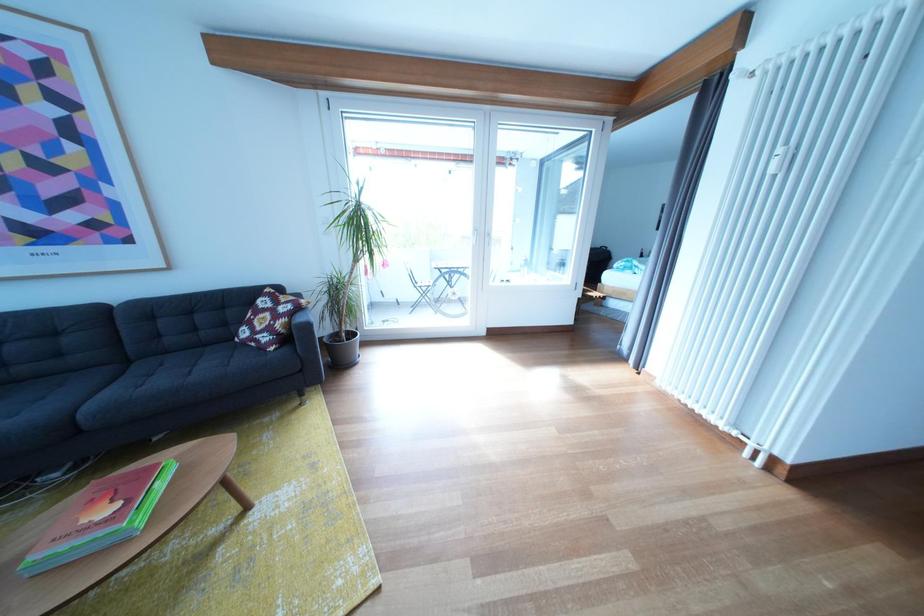
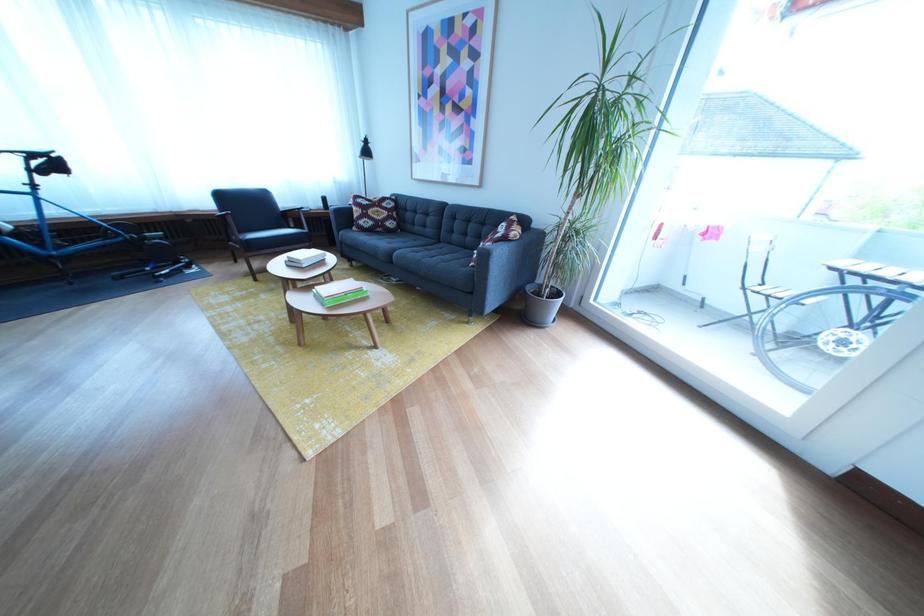
The point at (x=468, y=300) is marked in the first image. Where is the corresponding point in the second image?

(857, 349)